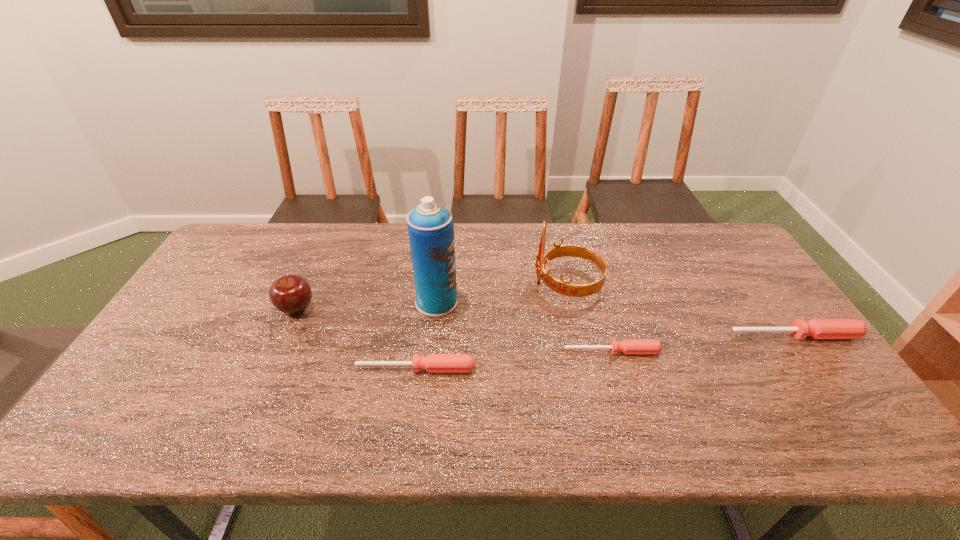
At what (x,y) coordinates should I click in order to perform the action: click on free space for a new screwdriver on the left. Please return your answer as a coordinate pair (x, y). This screenshot has height=540, width=960. Looking at the image, I should click on (204, 387).